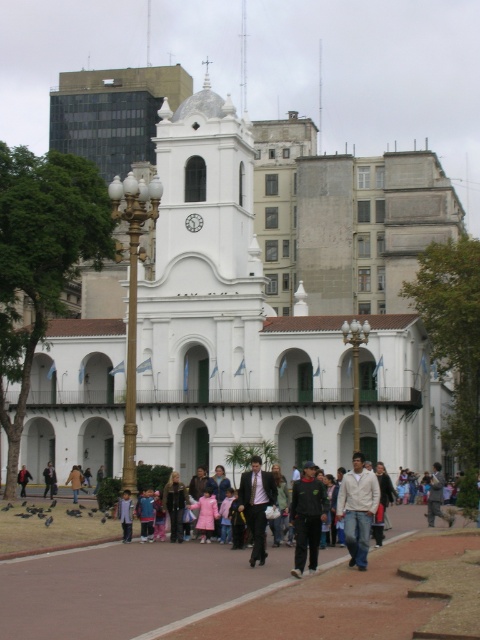
Question: Considering the real-world distances, which object is farthest from the light blue denim jacket at center?

Choices:
 (A) light pink fabric coat at center
 (B) smooth concrete pavement at center
 (C) light brown leather jacket at lower center

Answer: (A)

Question: Considering the relative positions of white smooth church at center and light brown leather jacket at lower center in the image provided, where is white smooth church at center located with respect to light brown leather jacket at lower center?

Choices:
 (A) right
 (B) left

Answer: (A)

Question: Can you confirm if smooth concrete pavement at center is positioned below light brown leather jacket at lower center?

Choices:
 (A) no
 (B) yes

Answer: (A)

Question: Which of the following is the closest to the observer?

Choices:
 (A) (122, 509)
 (B) (192, 564)
 (C) (45, 468)
 (D) (72, 468)

Answer: (B)

Question: Which of the following is the farthest from the observer?

Choices:
 (A) (299, 499)
 (B) (361, 529)

Answer: (A)

Question: Does white smooth church at center have a lesser width compared to light brown leather jacket at lower center?

Choices:
 (A) yes
 (B) no

Answer: (B)